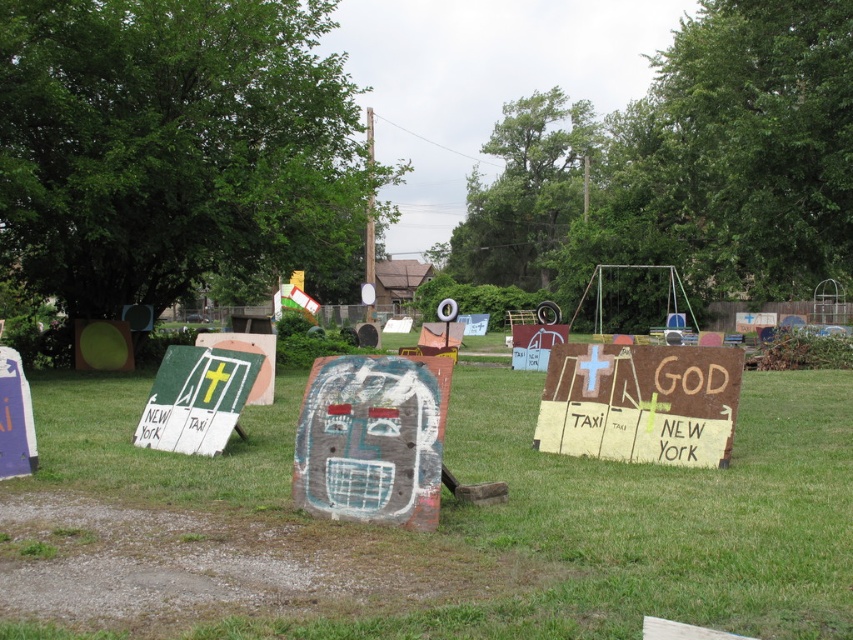
Is point (807, 566) positioned after point (364, 500)?

That is False.

Who is higher up, green grass at center or rusty wood sign at center?

rusty wood sign at center

This screenshot has width=853, height=640. What do you see at coordinates (521, 513) in the screenshot?
I see `green grass at center` at bounding box center [521, 513].

The width and height of the screenshot is (853, 640). What are the coordinates of `green grass at center` in the screenshot? It's located at point(521,513).

Is point (642, 508) positioned before point (198, 387)?

Yes, point (642, 508) is closer to viewer.

Is green grass at center to the left of green felt sign at center from the viewer's perspective?

No, green grass at center is not to the left of green felt sign at center.

Between point (283, 454) and point (172, 346), which one is positioned behind?

The point (172, 346) is more distant.

You are a GUI agent. You are given a task and a screenshot of the screen. Output one action in this format:
    pyautogui.click(x=<x>, y=<y>)
    Task: Click on the green grass at center
    This screenshot has height=640, width=853.
    Given the screenshot: What is the action you would take?
    pyautogui.click(x=521, y=513)

Is point (730, 598) positioned behind point (553, 364)?

No, it is in front of (553, 364).

Does green grass at center have a lesser width compared to rusty metal sign at center?

No.

Is point (0, 577) positioned after point (711, 440)?

No.

Find the location of `green grass at center`. green grass at center is located at coordinates (521, 513).